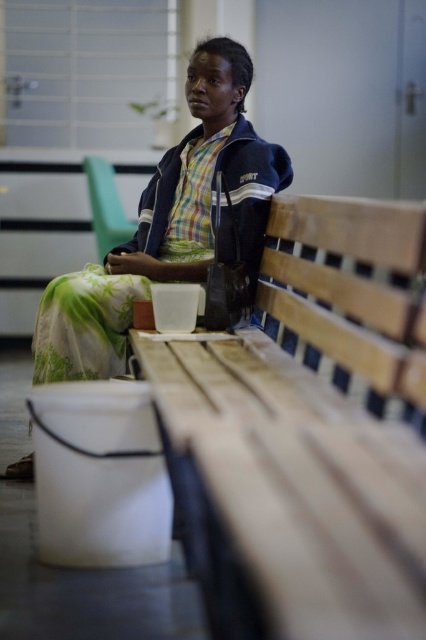
Can you confirm if wooden bench at center is wider than matte black jacket at center?

No.

Is wooden bench at center behind matte black jacket at center?

No.

Is point (385, 324) positioned before point (172, 256)?

Yes, point (385, 324) is in front of point (172, 256).

What are the coordinates of `wooden bench at center` in the screenshot? It's located at (307, 432).